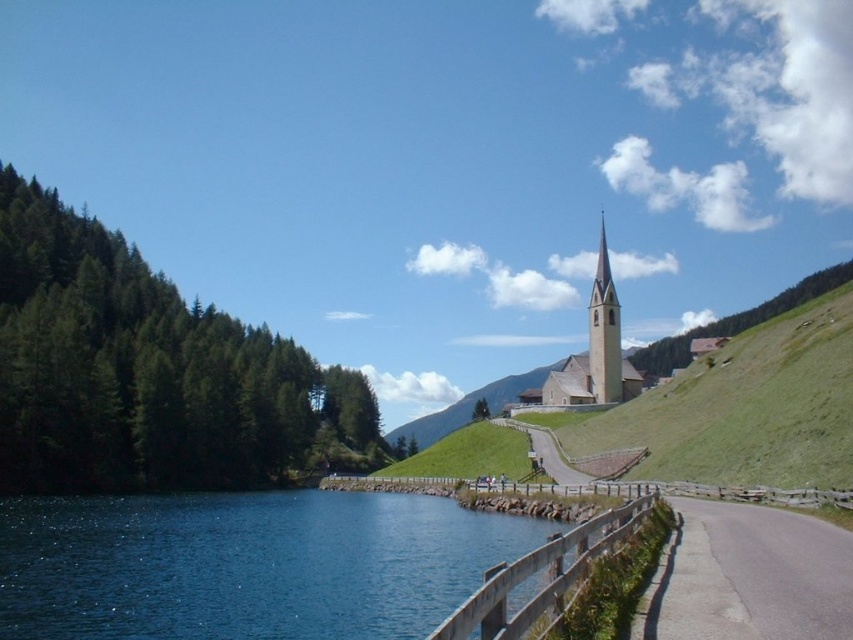
You are a drone operator planning to fly a drone from the blue water at lower left to the smooth beige church at center. What is the minimum distance the drone must travel to reach the church?

The blue water at lower left and smooth beige church at center are 69.96 meters apart from each other, so the minimum distance the drone must travel is 69.96 meters.